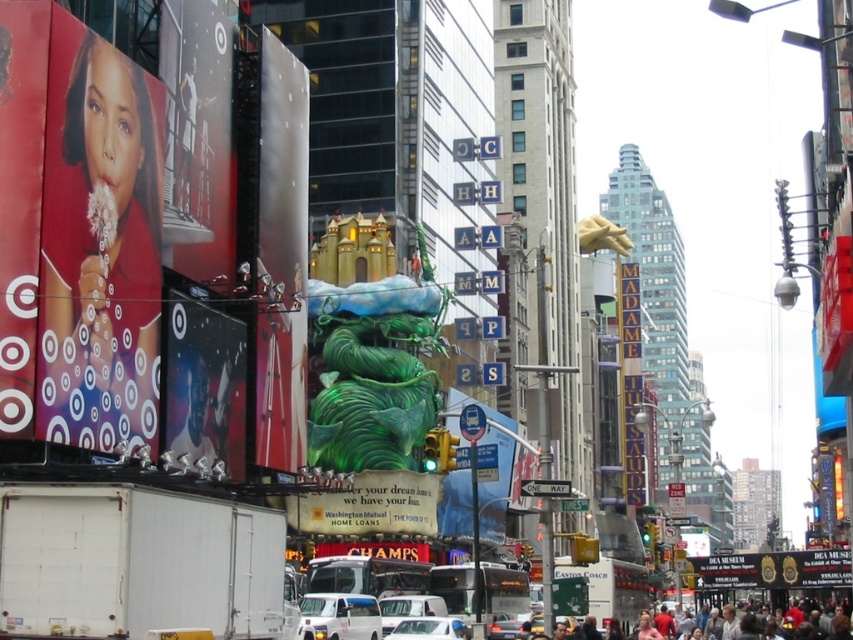
Question: Which is nearer to the metallic silver car at center?

Choices:
 (A) white glossy car at center
 (B) matte red billboard at left
 (C) green glossy statue at center
 (D) matte red dress at left

Answer: (C)

Question: Which object is positioned farthest from the black glossy sign at center?

Choices:
 (A) white matte car at center
 (B) matte red billboard at upper left

Answer: (B)

Question: From the image, what is the correct spatial relationship of white matte car at center in relation to metallic silver car at center?

Choices:
 (A) right
 (B) left

Answer: (B)

Question: Which is nearer to the matte red billboard at left?

Choices:
 (A) gold metallic sign at center
 (B) green glossy statue at center

Answer: (B)

Question: Does matte red dress at left have a greater width compared to white matte van at center?

Choices:
 (A) no
 (B) yes

Answer: (A)

Question: Does matte red billboard at left have a smaller size compared to white glossy car at center?

Choices:
 (A) no
 (B) yes

Answer: (A)